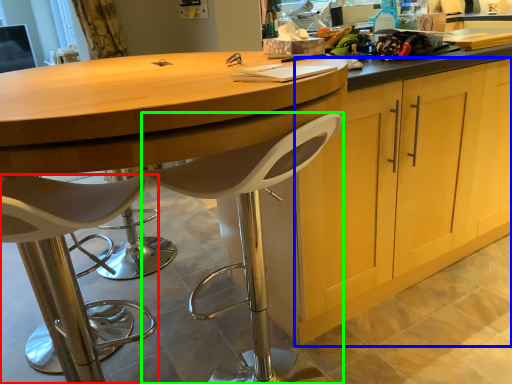
Question: Which is nearer to the chair (highlighted by a red box)? cabinetry (highlighted by a blue box) or chair (highlighted by a green box).

Choices:
 (A) cabinetry
 (B) chair

Answer: (B)